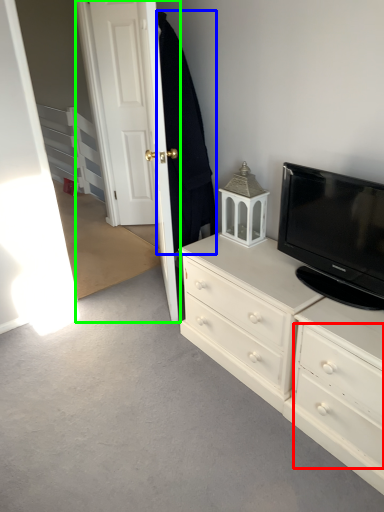
Question: Estimate the real-world distances between objects in this image. Which object is closer to drawer (highlighted by a red box), robe (highlighted by a blue box) or door (highlighted by a green box)?

Choices:
 (A) robe
 (B) door

Answer: (A)